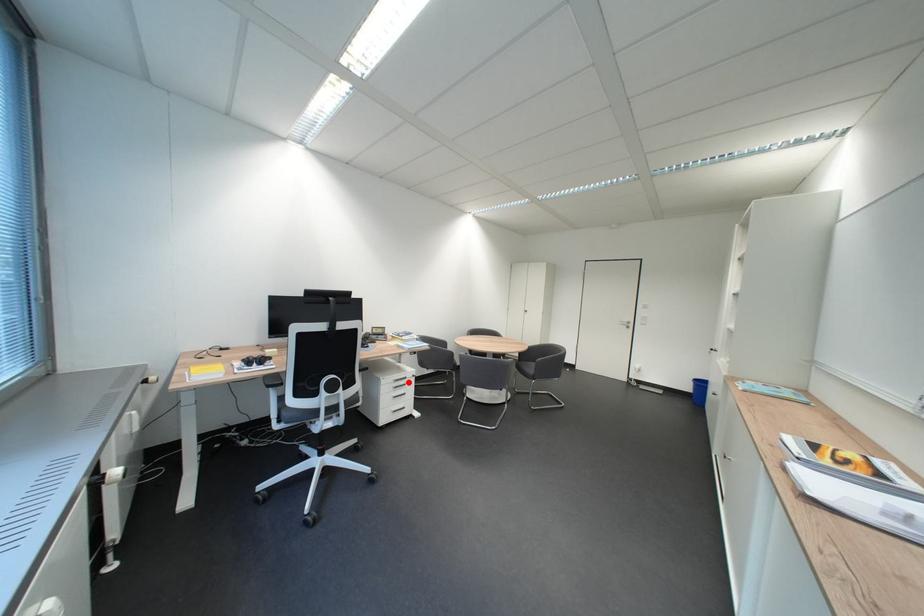
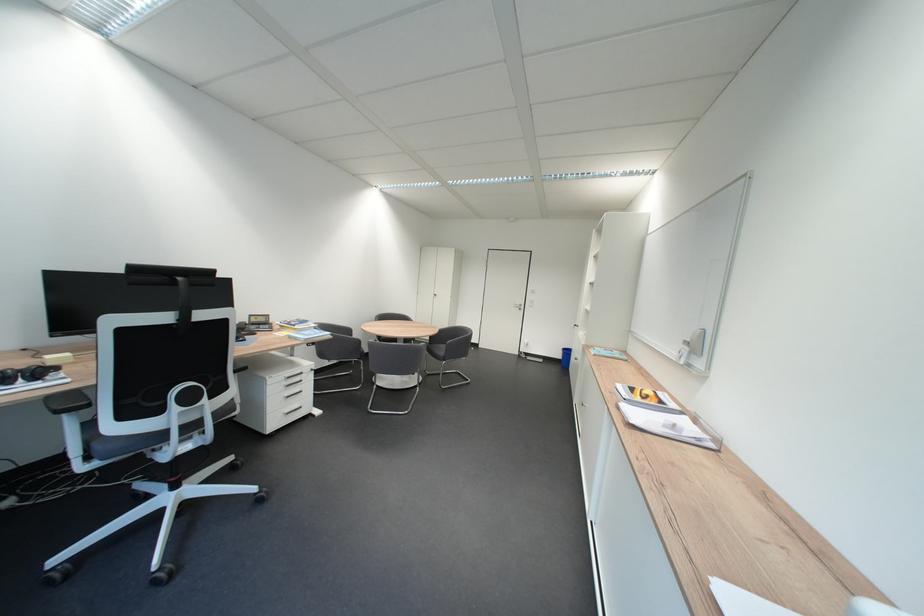
Where in the second image is the point corresponding to the highlighted location from the first image?

(300, 379)